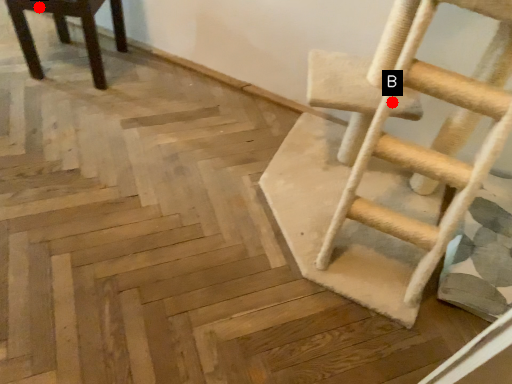
Question: Two points are circled on the image, labeled by A and B beside each circle. Which point is closer to the camera?

Choices:
 (A) A is closer
 (B) B is closer

Answer: (B)